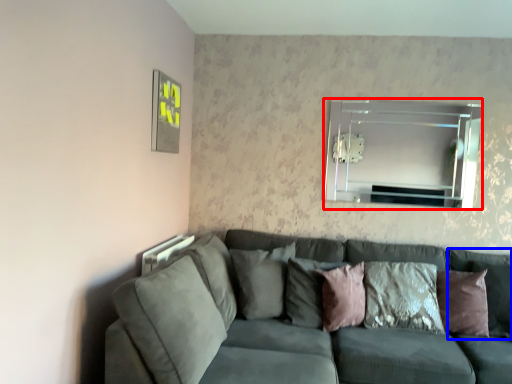
Question: Which of the following is the farthest to the observer, mirror (highlighted by a red box) or pillow (highlighted by a blue box)?

Choices:
 (A) mirror
 (B) pillow

Answer: (A)